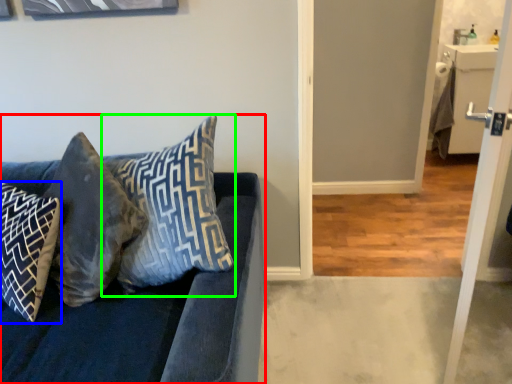
Question: Which object is the closest to the studio couch (highlighted by a red box)? Choose among these: pillow (highlighted by a blue box) or pillow (highlighted by a green box).

Choices:
 (A) pillow
 (B) pillow

Answer: (B)